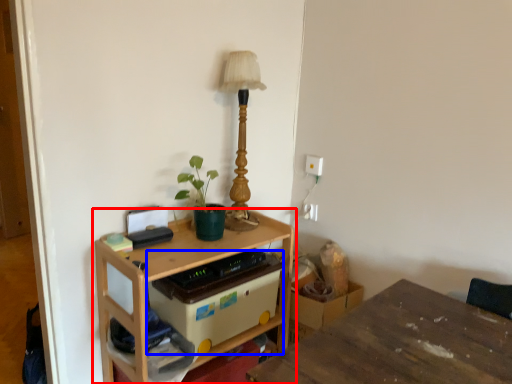
Question: Which of the following is the closest to the observer, table (highlighted by a red box) or storage box (highlighted by a blue box)?

Choices:
 (A) table
 (B) storage box

Answer: (A)